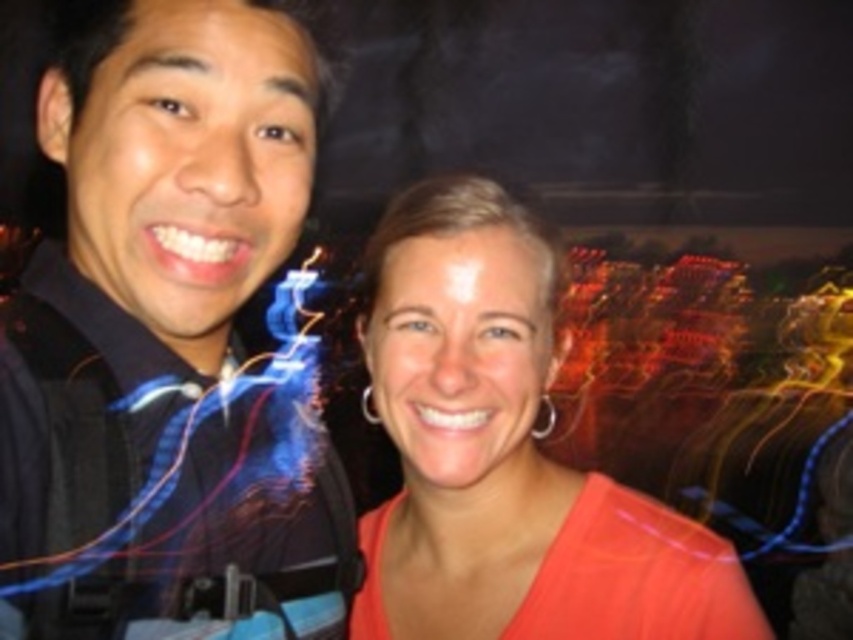
Consider the image. Can you confirm if black matte shirt at left is positioned below orange matte shirt at center?

Incorrect, black matte shirt at left is not positioned below orange matte shirt at center.

Is black matte shirt at left above orange matte shirt at center?

Yes, black matte shirt at left is above orange matte shirt at center.

This screenshot has width=853, height=640. Identify the location of black matte shirt at left. (169, 339).

Where is `black matte shirt at left`? This screenshot has width=853, height=640. black matte shirt at left is located at coordinates (169, 339).